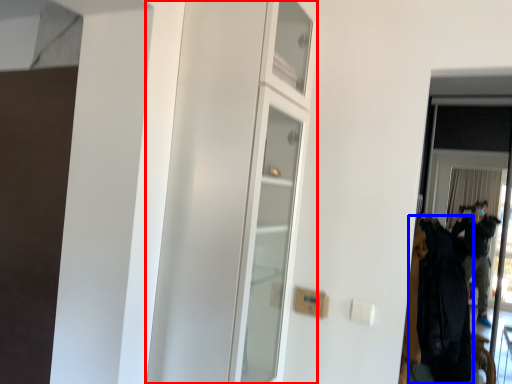
Question: Which object is closer to the camera taking this photo, dresser (highlighted by a red box) or clothing (highlighted by a blue box)?

Choices:
 (A) dresser
 (B) clothing

Answer: (A)